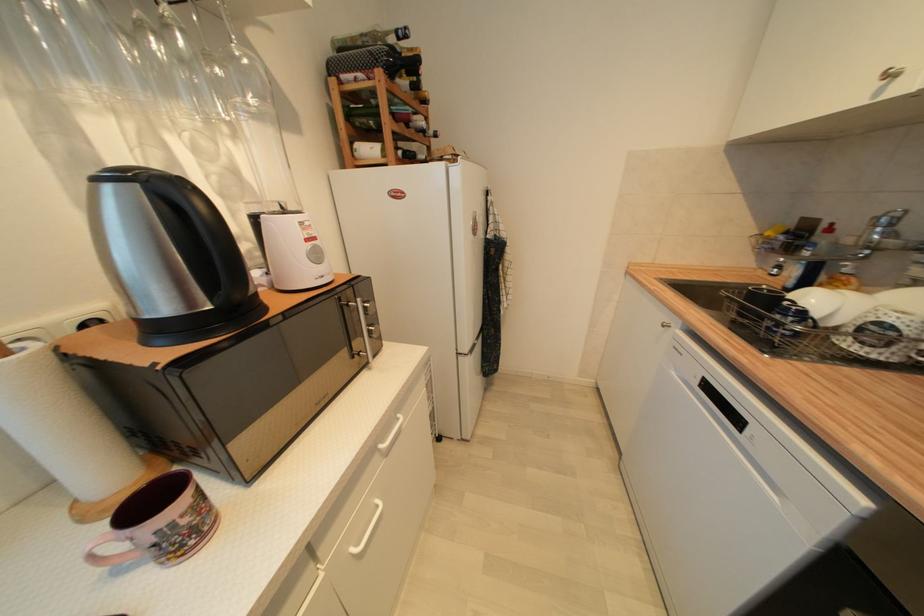
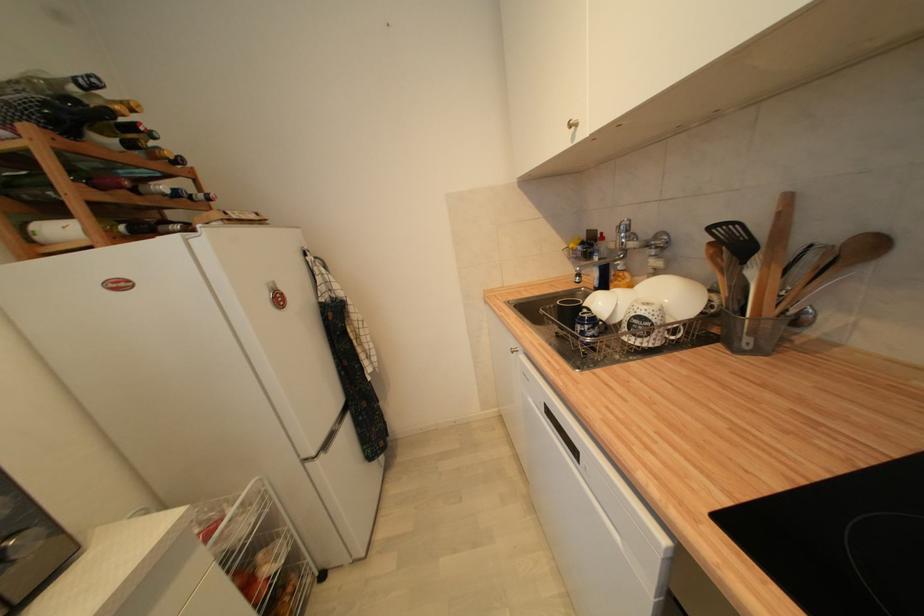
Where in the second image is the point corresponding to the point at 412,77 from the first image?

(128, 132)